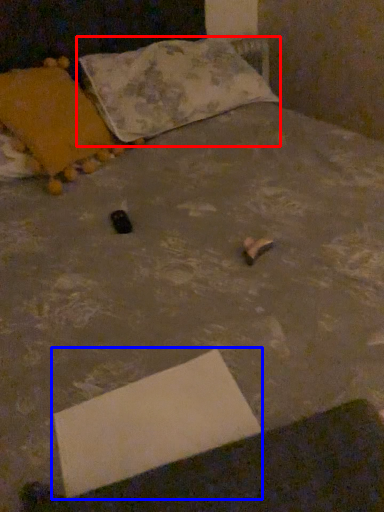
Question: Which of the following is the farthest to the observer, pillow (highlighted by a red box) or cardboard box (highlighted by a blue box)?

Choices:
 (A) pillow
 (B) cardboard box

Answer: (A)